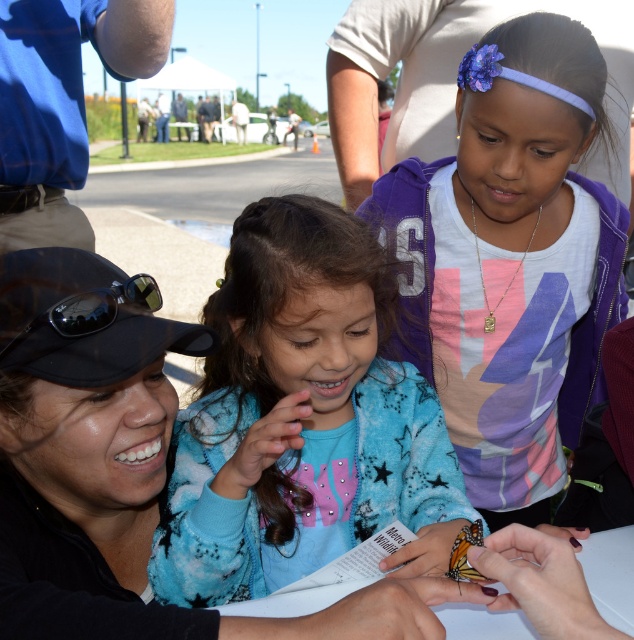
You are a photographer at the event and want to capture a photo that includes both the blue fleece jacket at center and the blue shirt at upper left. Which one should you focus on to ensure both are in the frame?

To ensure both the blue fleece jacket at center and the blue shirt at upper left are in the frame, focus on the blue fleece jacket at center since it is in front of the blue shirt at upper left, allowing both to be visible in the photo.

You are a photographer standing at the scene and want to take a photo that includes both the blue fleece jacket at center and the blue shirt at upper left. Given that your camera has a maximum focus range of 4 feet, will both subjects be in focus?

The distance between the blue fleece jacket at center and the blue shirt at upper left is 3.95 feet, which is within the camera maximum focus range of 4 feet. Therefore, both subjects will be in focus.